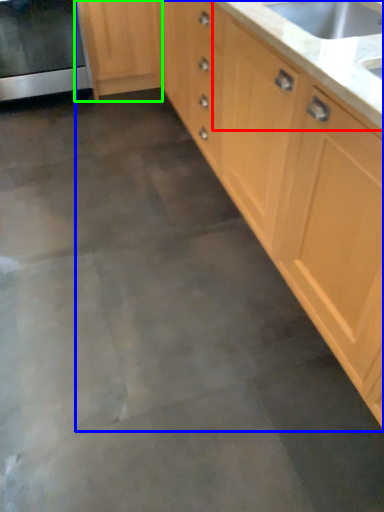
Question: Which object is the farthest from countertop (highlighted by a red box)? Choose among these: cabinetry (highlighted by a blue box) or cabinetry (highlighted by a green box).

Choices:
 (A) cabinetry
 (B) cabinetry

Answer: (B)